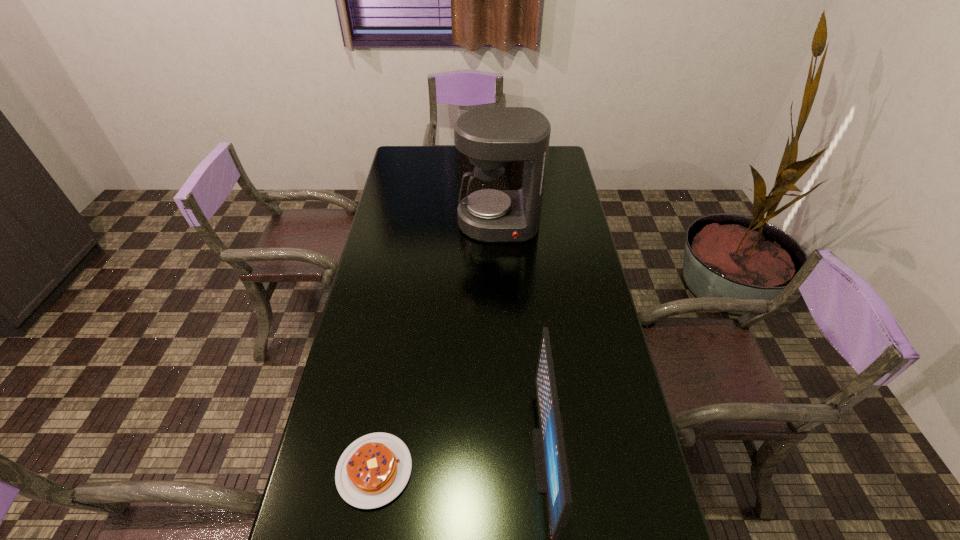
Locate an element on the screen. This screenshot has height=540, width=960. free spot at the far left corner of the desktop is located at coordinates click(409, 154).

This screenshot has height=540, width=960. What are the coordinates of `vacant space at the far right corner` in the screenshot? It's located at (565, 164).

The width and height of the screenshot is (960, 540). What are the coordinates of `vacant region between the tallest object and the pancake` in the screenshot? It's located at (437, 347).

Find the location of a particular element. The height and width of the screenshot is (540, 960). free spot between the farthest object and the shortest object is located at coordinates (437, 347).

You are a GUI agent. You are given a task and a screenshot of the screen. Output one action in this format:
    pyautogui.click(x=<x>, y=<y>)
    Task: Click on the empty space between the tallest object and the leftmost object
    
    Given the screenshot: What is the action you would take?
    (437, 347)

Find the location of a particular element. This screenshot has height=540, width=960. blank region between the leftmost object and the farthest object is located at coordinates (437, 347).

Identify the location of unoccupied area between the shortest object and the farthest object. (437, 347).

Point out which object is positioned as the second nearest to the second tallest object. Please provide its 2D coordinates. Your answer should be formatted as a tuple, i.e. [(x, y)], where the tuple contains the x and y coordinates of a point satisfying the conditions above.

[(491, 137)]

Where is `object that can be found as the closest to the leftmost object`? object that can be found as the closest to the leftmost object is located at coordinates (553, 476).